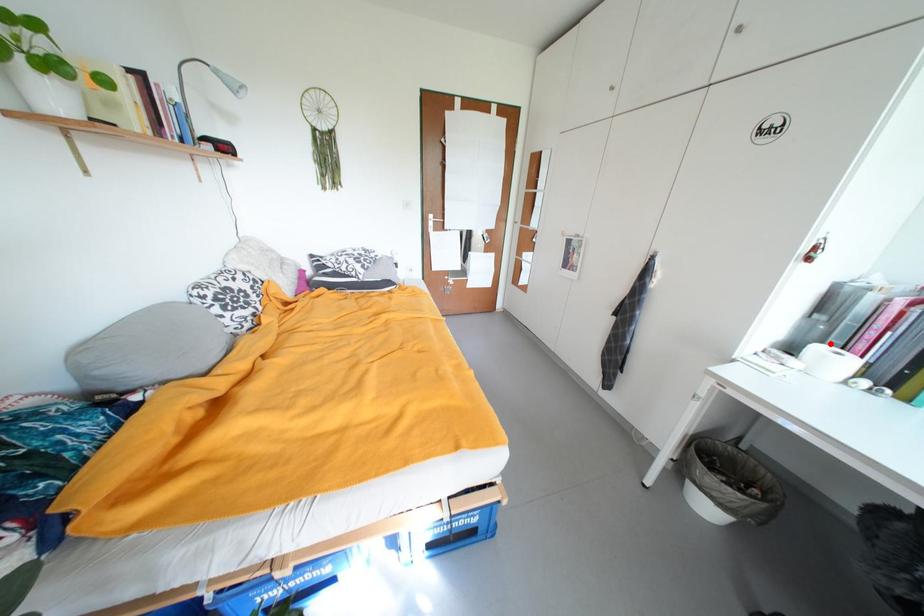
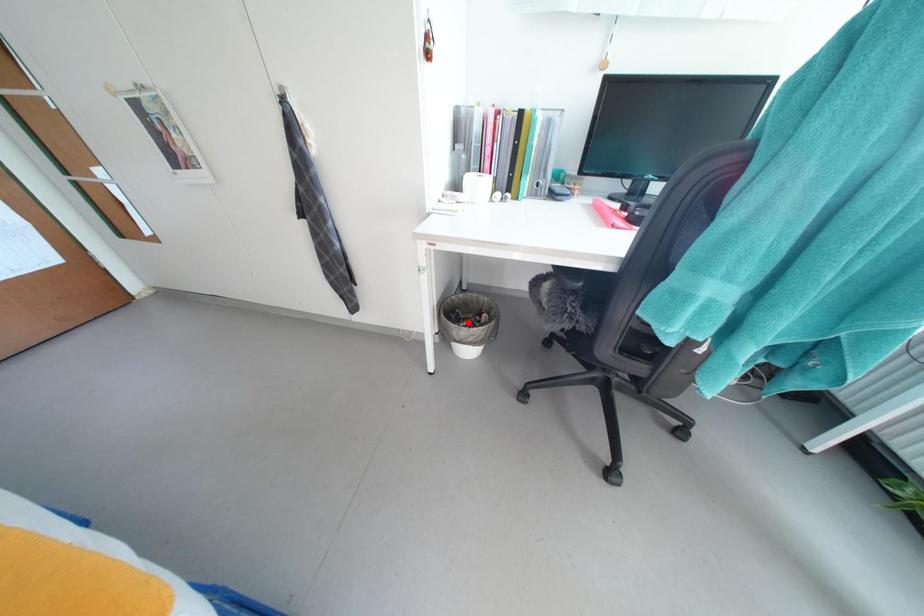
I am providing you with two images of the same scene from different viewpoints. A red point is marked on the first image and another point is marked on the second image. Are the points marked in image1 and image2 representing the same 3D position?

No